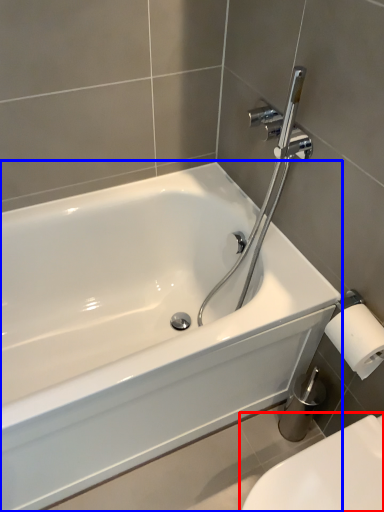
Question: Among these objects, which one is nearest to the camera, toilet (highlighted by a red box) or bathtub (highlighted by a blue box)?

Choices:
 (A) toilet
 (B) bathtub

Answer: (A)